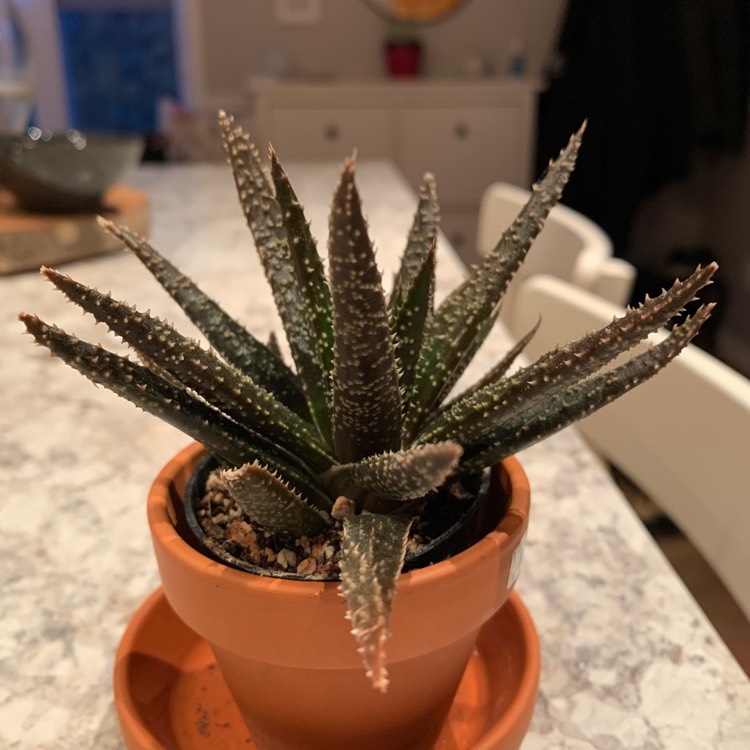
Where is `back chair`? Image resolution: width=750 pixels, height=750 pixels. back chair is located at coordinates (572, 256).